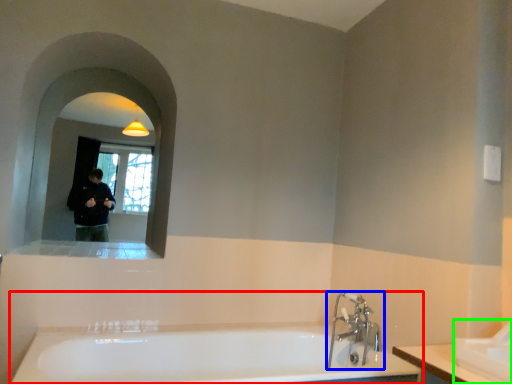
Question: Based on their relative distances, which object is farther from bathtub (highlighted by a red box)? Choose from tap (highlighted by a blue box) and sink (highlighted by a green box).

Choices:
 (A) tap
 (B) sink

Answer: (B)